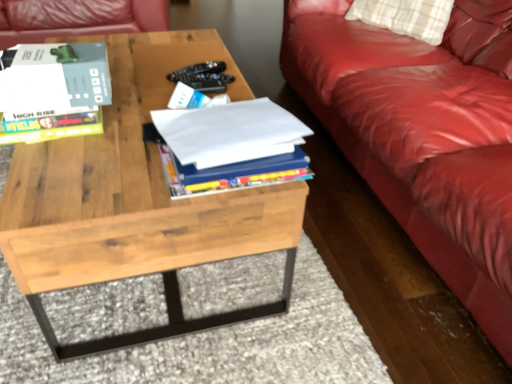
This screenshot has width=512, height=384. I want to click on vacant space situated on the left part of white paper at center, marked as the 2th book in a left-to-right arrangement, so click(x=92, y=167).